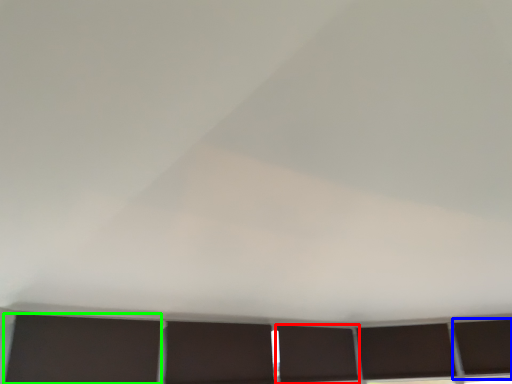
Question: Which object is positioned farthest from window (highlighted by a red box)? Select from window (highlighted by a blue box) and shutter (highlighted by a green box).

Choices:
 (A) window
 (B) shutter

Answer: (B)